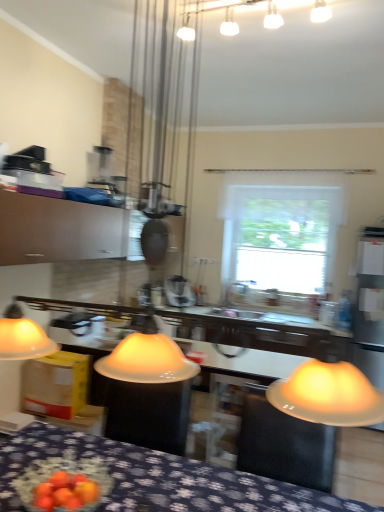
This screenshot has height=512, width=384. I want to click on matte white cabinet at upper left, so pyautogui.click(x=59, y=230).

Image resolution: width=384 pixels, height=512 pixels. What do you see at coordinates (212, 12) in the screenshot?
I see `white frosted glass light fixture at upper center` at bounding box center [212, 12].

Measure the distance between point (36, 456) and camera.

5.66 feet.

The width and height of the screenshot is (384, 512). What do you see at coordinates (237, 313) in the screenshot? I see `white glossy sink at center` at bounding box center [237, 313].

You are a GUI agent. You are given a task and a screenshot of the screen. Output one action in this format:
    pyautogui.click(x=<x>, y=<y>)
    Task: Click on the matte white cabinet at upper left
    The height and width of the screenshot is (512, 384).
    Given the screenshot: What is the action you would take?
    pyautogui.click(x=59, y=230)

Considering the sizes of white frosted glass light fixture at upper center and metallic silver blender at center in the image, is white frosted glass light fixture at upper center taller or shorter than metallic silver blender at center?

white frosted glass light fixture at upper center is shorter than metallic silver blender at center.

This screenshot has height=512, width=384. I want to click on appliance below the white frosted glass light fixture at upper center (from a real-world perspective), so click(179, 292).

From the image's perspective, between white frosted glass light fixture at upper center and metallic silver blender at center, which one is located above?

white frosted glass light fixture at upper center is shown above in the image.

Does point (277, 14) appear closer or farther from the camera than point (177, 280)?

Point (277, 14) is closer to the camera than point (177, 280).

Can we say white matte window at center lies outside white frosted glass light fixture at upper center?

Indeed, white matte window at center is completely outside white frosted glass light fixture at upper center.

Who is smaller, white matte window at center or white frosted glass light fixture at upper center?

Smaller between the two is white frosted glass light fixture at upper center.

Would you consider white matte window at center to be distant from white frosted glass light fixture at upper center?

white matte window at center is positioned a significant distance from white frosted glass light fixture at upper center.

Which is more to the left, white matte window at center or white frosted glass light fixture at upper center?

white frosted glass light fixture at upper center is more to the left.

Considering the relative sizes of white frosted glass light fixture at upper center and white matte window at center in the image provided, is white frosted glass light fixture at upper center taller than white matte window at center?

In fact, white frosted glass light fixture at upper center may be shorter than white matte window at center.

Is white frosted glass light fixture at upper center looking in the opposite direction of white matte window at center?

No, white frosted glass light fixture at upper center is not facing the opposite direction of white matte window at center.

Looking at this image, are white frosted glass light fixture at upper center and white matte window at center far apart?

Yes, white frosted glass light fixture at upper center and white matte window at center are quite far apart.

How many degrees apart are the facing directions of white matte window at center and metallic silver blender at center?

The angular difference between white matte window at center and metallic silver blender at center is 138 degrees.

From the picture: Is white matte window at center closer to camera compared to metallic silver blender at center?

That is False.

Would you consider white matte window at center to be distant from metallic silver blender at center?

white matte window at center is far away from metallic silver blender at center.

Can you confirm if white matte window at center is wider than metallic silver blender at center?

Indeed, white matte window at center has a greater width compared to metallic silver blender at center.

Based on the photo, is white matte window at center completely or partially inside metallic silver blender at center?

No, white matte window at center is not a part of metallic silver blender at center.

Which object is further away from the camera taking this photo, metallic silver blender at center or white matte window at center?

white matte window at center is further from the camera.

From the image's perspective, between metallic silver blender at center and white matte window at center, who is located below?

metallic silver blender at center, from the image's perspective.

Considering the sizes of metallic silver blender at center and blue fabric tablecloth at lower center in the image, is metallic silver blender at center wider or thinner than blue fabric tablecloth at lower center?

Considering their sizes, metallic silver blender at center looks slimmer than blue fabric tablecloth at lower center.

Is metallic silver blender at center facing towards blue fabric tablecloth at lower center?

No, metallic silver blender at center is not facing towards blue fabric tablecloth at lower center.

Considering the sizes of objects metallic silver blender at center and blue fabric tablecloth at lower center in the image provided, who is bigger, metallic silver blender at center or blue fabric tablecloth at lower center?

blue fabric tablecloth at lower center is bigger.

The width and height of the screenshot is (384, 512). I want to click on furniture lying in front of the white frosted glass light fixture at upper center, so click(x=158, y=478).

Considering the relative positions of white frosted glass light fixture at upper center and blue fabric tablecloth at lower center in the image provided, is white frosted glass light fixture at upper center to the right of blue fabric tablecloth at lower center from the viewer's perspective?

Yes.

Can you tell me how much white frosted glass light fixture at upper center and blue fabric tablecloth at lower center differ in facing direction?

The angle between the facing direction of white frosted glass light fixture at upper center and the facing direction of blue fabric tablecloth at lower center is 83.8 degrees.

The image size is (384, 512). In the image, there is a white frosted glass light fixture at upper center. In order to click on appliance below it (from the image's perspective) in this screenshot , I will do `click(179, 292)`.

Locate an element on the screen. Image resolution: width=384 pixels, height=512 pixels. lamp to the left of white matte window at center is located at coordinates (212, 12).

Which object lies nearer to the anchor point metallic silver blender at center, white glossy sink at center or white matte window at center?

white glossy sink at center lies closer to metallic silver blender at center than the other object.

From the image, which object appears to be farther from metallic silver blender at center, blue fabric tablecloth at lower center or white matte window at center?

white matte window at center is further to metallic silver blender at center.

From the image, which object appears to be farther from blue fabric tablecloth at lower center, white matte window at center or matte white cabinet at upper left?

white matte window at center.

Considering their positions, is metallic silver blender at center positioned further to white frosted glass light fixture at upper center than white matte window at center?

white matte window at center is positioned further to the anchor white frosted glass light fixture at upper center.

From the picture: Estimate the real-world distances between objects in this image. Which object is further from matte white cabinet at upper left, white frosted glass light fixture at upper center or metallic silver blender at center?

Among the two, white frosted glass light fixture at upper center is located further to matte white cabinet at upper left.

Considering their positions, is matte white cabinet at upper left positioned further to white matte window at center than metallic silver blender at center?

matte white cabinet at upper left lies further to white matte window at center than the other object.

Considering their positions, is white matte window at center positioned further to white frosted glass light fixture at upper center than metallic silver blender at center?

The object further to white frosted glass light fixture at upper center is white matte window at center.

Looking at this image, based on their spatial positions, is matte white cabinet at upper left or metallic silver blender at center further from white glossy sink at center?

matte white cabinet at upper left lies further to white glossy sink at center than the other object.

I want to click on cabinetry located between blue fabric tablecloth at lower center and white glossy sink at center in the depth direction, so [59, 230].

The height and width of the screenshot is (512, 384). I want to click on sink located between matte white cabinet at upper left and metallic silver blender at center in the depth direction, so click(x=237, y=313).

In order to click on cabinetry between blue fabric tablecloth at lower center and metallic silver blender at center in the front-back direction in this screenshot , I will do `click(59, 230)`.

Image resolution: width=384 pixels, height=512 pixels. In order to click on appliance positioned between blue fabric tablecloth at lower center and white matte window at center from near to far in this screenshot , I will do `click(179, 292)`.